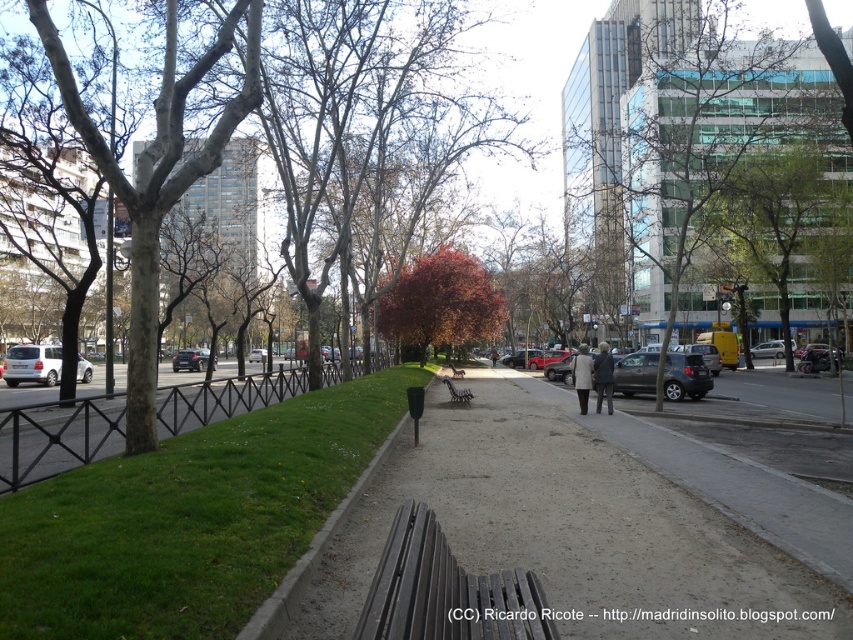
Can you confirm if green concrete curb at lower left is taller than dark gray jacket at center?

Incorrect, green concrete curb at lower left's height is not larger of dark gray jacket at center's.

Which is behind, point (242, 630) or point (490, 358)?

The point (490, 358) is more distant.

I want to click on green concrete curb at lower left, so click(x=312, y=554).

Does green grass at left appear under green leafy tree at right?

Yes, green grass at left is below green leafy tree at right.

Find the location of a particular element. green grass at left is located at coordinates (189, 518).

Image resolution: width=853 pixels, height=640 pixels. In order to click on green grass at left in this screenshot , I will do `click(189, 518)`.

Does green leafy tree at right have a smaller size compared to light beige coat at center?

Actually, green leafy tree at right might be larger than light beige coat at center.

Between green leafy tree at right and light beige coat at center, which one is positioned lower?

light beige coat at center is lower down.

Which is in front, point (611, 90) or point (582, 384)?

Point (582, 384) is in front.

At what (x,y) coordinates should I click in order to perform the action: click on green leafy tree at right. Please return your answer as a coordinate pair (x, y). Looking at the image, I should click on (674, 129).